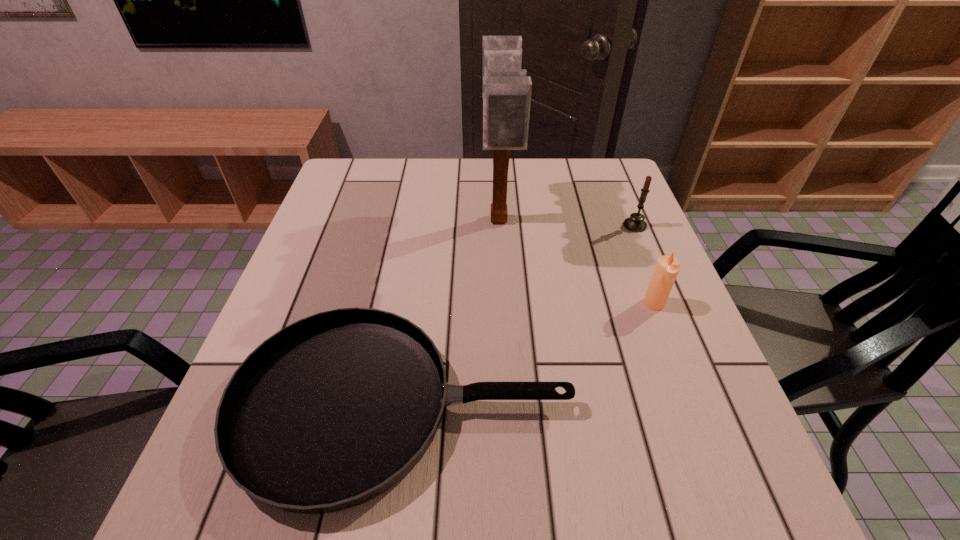
Where is `vacant area that lies between the mallet and the farther candle`? vacant area that lies between the mallet and the farther candle is located at coordinates (566, 224).

At what (x,y) coordinates should I click in order to perform the action: click on object that can be found as the third closest to the second nearest object. Please return your answer as a coordinate pair (x, y). This screenshot has height=540, width=960. Looking at the image, I should click on coord(506,89).

The height and width of the screenshot is (540, 960). I want to click on the second closest object to the farther candle, so click(x=506, y=89).

Identify the location of vacant space that satisfies the following two spatial constraints: 1. on the back side of the nearer candle; 2. on the left side of the farther candle. This screenshot has width=960, height=540. (624, 226).